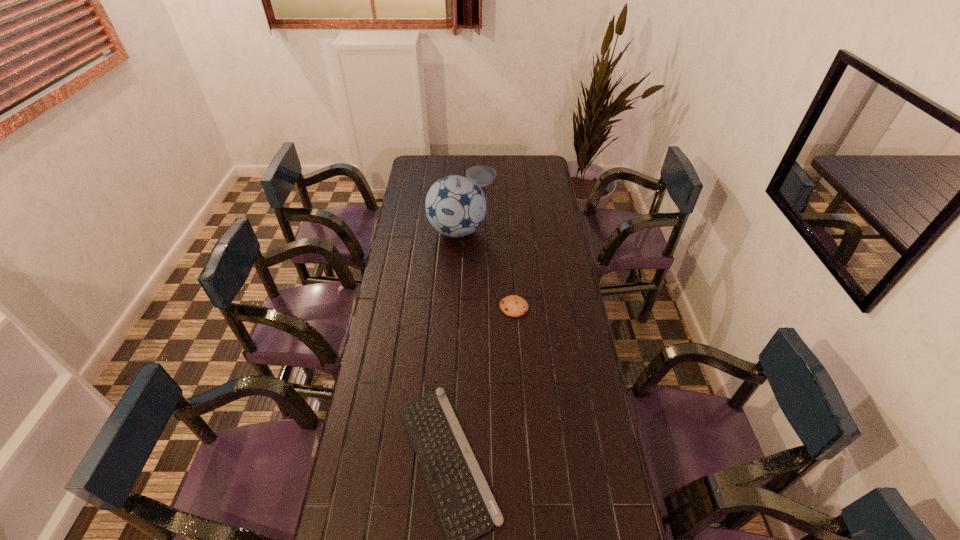
Identify the location of the second farthest object. The image size is (960, 540). (455, 205).

The width and height of the screenshot is (960, 540). I want to click on the tallest object, so click(x=455, y=205).

What are the coordinates of `bowl` in the screenshot? It's located at (483, 175).

The height and width of the screenshot is (540, 960). What are the coordinates of `the second tallest object` in the screenshot? It's located at (483, 175).

You are a GUI agent. You are given a task and a screenshot of the screen. Output one action in this format:
    pyautogui.click(x=<x>, y=<y>)
    Task: Click on the third farthest object
    
    Given the screenshot: What is the action you would take?
    pyautogui.click(x=514, y=306)

This screenshot has height=540, width=960. Find the location of `vacant space positioned 0.060m on the side with brand of the third nearest object`. vacant space positioned 0.060m on the side with brand of the third nearest object is located at coordinates (455, 259).

I want to click on vacant space located 0.260m on the right of the farthest object, so click(544, 184).

The image size is (960, 540). I want to click on free space located 0.230m on the left of the cookie, so click(442, 307).

Locate an element on the screen. This screenshot has width=960, height=540. object that is at the far edge is located at coordinates pyautogui.click(x=483, y=175).

Locate an element on the screen. The image size is (960, 540). object that is at the left edge is located at coordinates (455, 205).